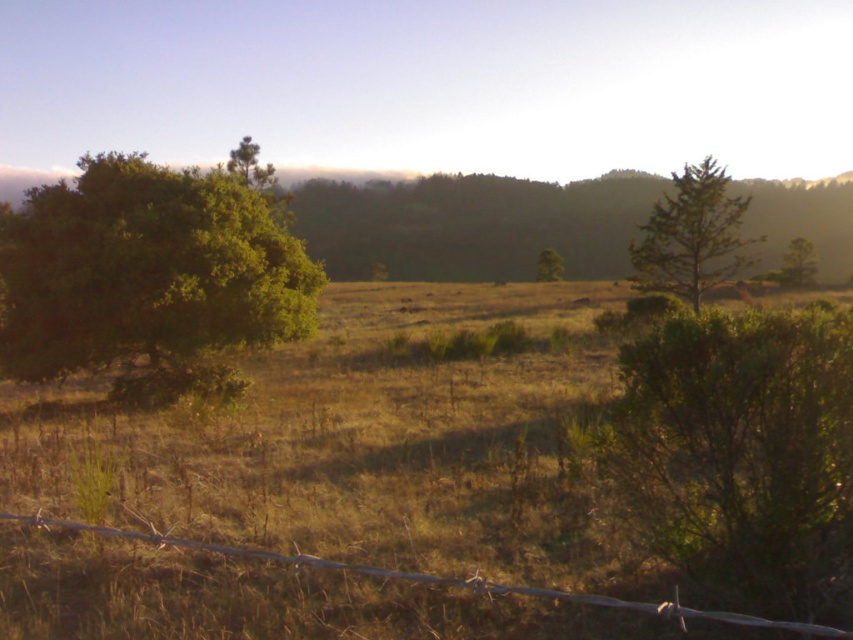
Question: Where is green leafy tree at right located in relation to green matte tree at center in the image?

Choices:
 (A) left
 (B) right

Answer: (B)

Question: Does green leafy tree at left have a greater width compared to green matte tree at center?

Choices:
 (A) yes
 (B) no

Answer: (A)

Question: Does metal wire fence at lower center come in front of green matte tree at center?

Choices:
 (A) no
 (B) yes

Answer: (B)

Question: Which point appears closest to the camera in this image?

Choices:
 (A) (67, 332)
 (B) (560, 257)
 (C) (689, 272)
 (D) (428, 576)

Answer: (D)

Question: Estimate the real-world distances between objects in this image. Which object is farther from the green matte tree at center?

Choices:
 (A) metal wire fence at lower center
 (B) green leafy tree at right

Answer: (A)

Question: Estimate the real-world distances between objects in this image. Which object is closer to the green leafy tree at left?

Choices:
 (A) green textured tree at upper right
 (B) green matte tree at upper center
 (C) green leafy tree at right

Answer: (B)